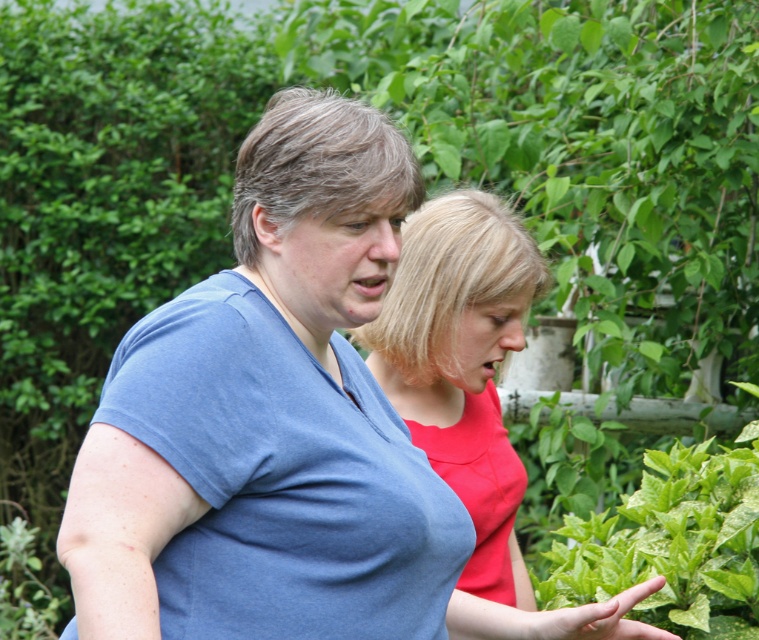
Is blue cotton shirt at center positioned in front of matte red blouse at center?

Yes, it is in front of matte red blouse at center.

Between blue cotton shirt at center and matte red blouse at center, which one appears on the right side from the viewer's perspective?

Positioned to the right is matte red blouse at center.

From the picture: Who is more forward, (244, 148) or (430, 244)?

Point (244, 148) is in front.

Locate an element on the screen. This screenshot has width=759, height=640. blue cotton shirt at center is located at coordinates (269, 419).

Does blue cotton shirt at center have a lesser width compared to green leafy plant at center?

No, blue cotton shirt at center is not thinner than green leafy plant at center.

Who is lower down, blue cotton shirt at center or green leafy plant at center?

green leafy plant at center is below.

Where is `blue cotton shirt at center`? blue cotton shirt at center is located at coordinates (269, 419).

Does matte red blouse at center have a larger size compared to green leafy plant at center?

No, matte red blouse at center is not bigger than green leafy plant at center.

Does matte red blouse at center have a greater width compared to green leafy plant at center?

In fact, matte red blouse at center might be narrower than green leafy plant at center.

Locate an element on the screen. matte red blouse at center is located at coordinates (461, 362).